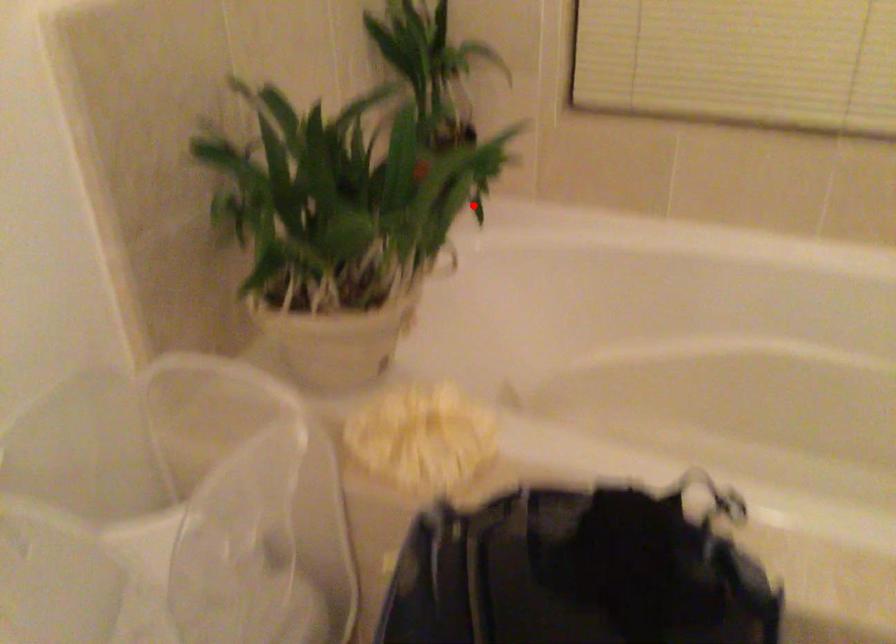
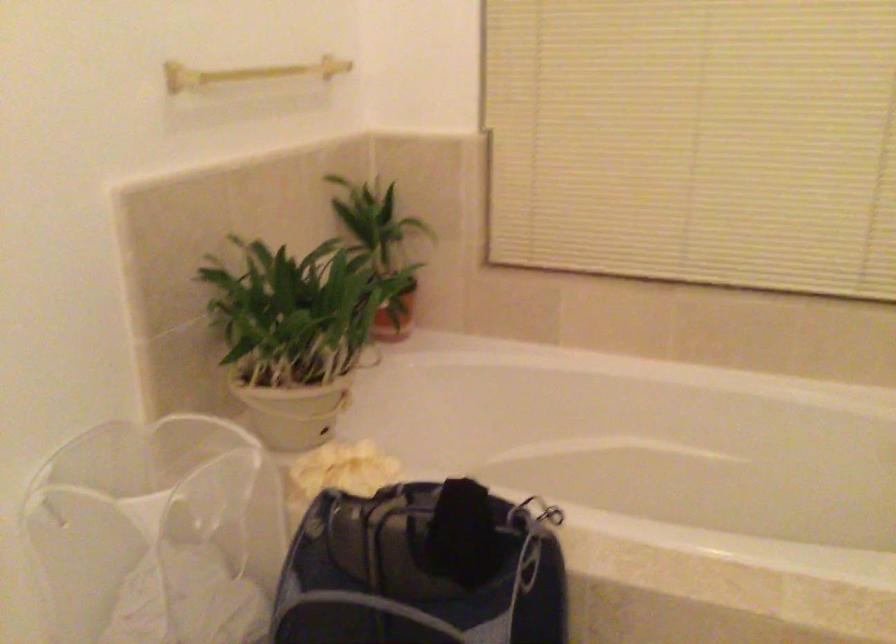
Question: I am providing you with two images of the same scene from different viewpoints. A red point is shown in image1. For the corresponding object point in image2, is it positioned nearer or farther from the camera?

Choices:
 (A) Nearer
 (B) Farther

Answer: (B)